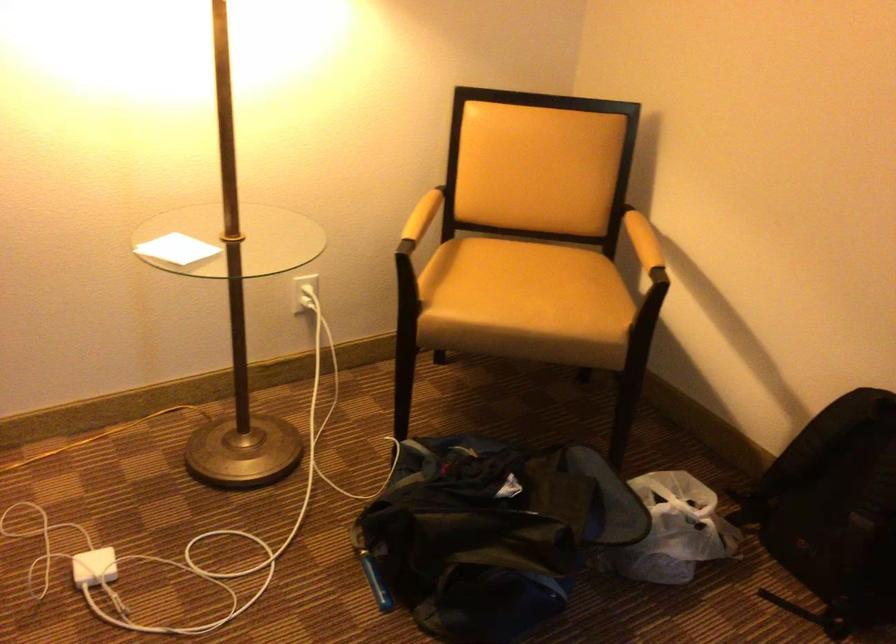
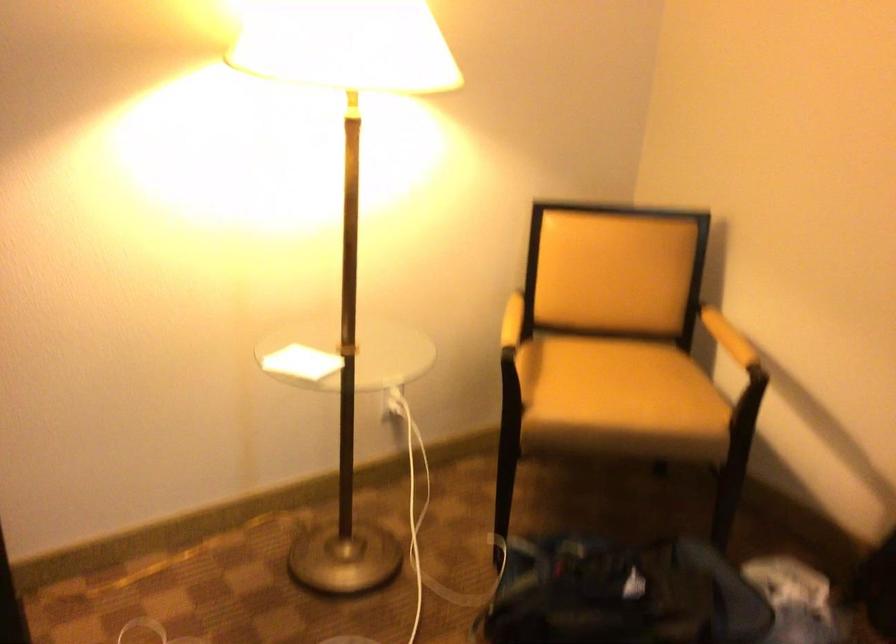
Locate, in the second image, the point that corresponds to pixel 643 243 in the first image.

(728, 337)